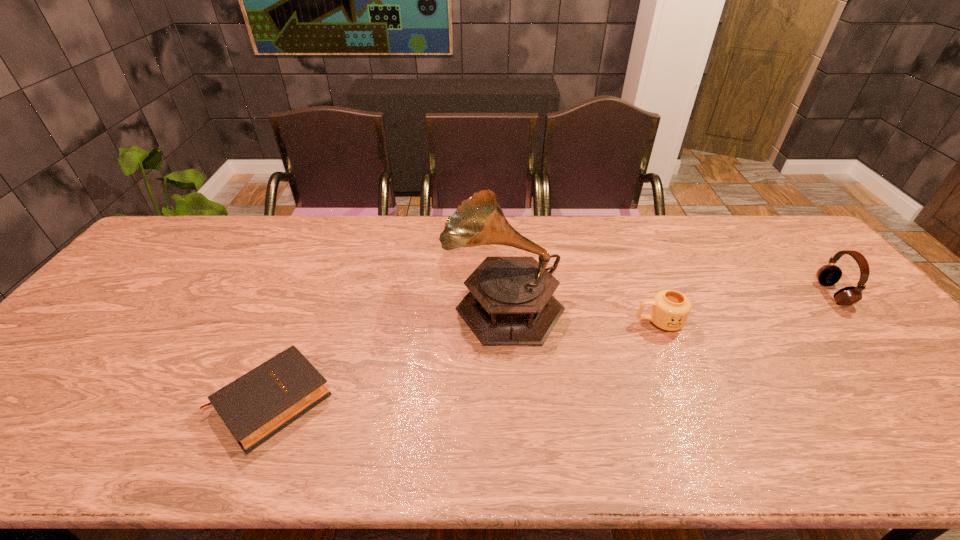
This screenshot has width=960, height=540. I want to click on the second object from left to right, so click(x=511, y=302).

You are a GUI agent. You are given a task and a screenshot of the screen. Output one action in this format:
    pyautogui.click(x=<x>, y=<y>)
    Task: Click on the phonograph record
    This screenshot has width=960, height=540.
    Given the screenshot: What is the action you would take?
    pyautogui.click(x=511, y=302)

This screenshot has height=540, width=960. In order to click on the rightmost object in this screenshot , I will do `click(827, 275)`.

The width and height of the screenshot is (960, 540). I want to click on the second tallest object, so click(827, 275).

Locate an element on the screen. the second object from right to left is located at coordinates (669, 310).

This screenshot has width=960, height=540. I want to click on the third tallest object, so click(x=669, y=310).

I want to click on Bible, so (254, 407).

You are a GUI agent. You are given a task and a screenshot of the screen. Output one action in this format:
    pyautogui.click(x=<x>, y=<y>)
    Task: Click on the leftmost object
    The image size is (960, 540).
    Given the screenshot: What is the action you would take?
    pyautogui.click(x=254, y=407)

This screenshot has width=960, height=540. Identify the location of free location located 0.170m on the horn direction of the phonograph record. (382, 303).

Locate an element on the screen. The height and width of the screenshot is (540, 960). vacant region located 0.330m on the horn direction of the phonograph record is located at coordinates (325, 303).